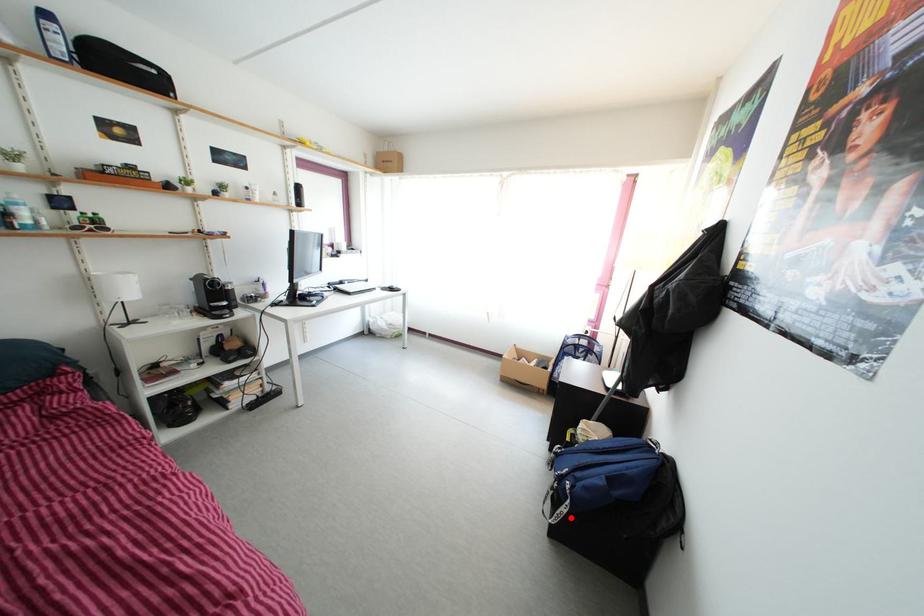
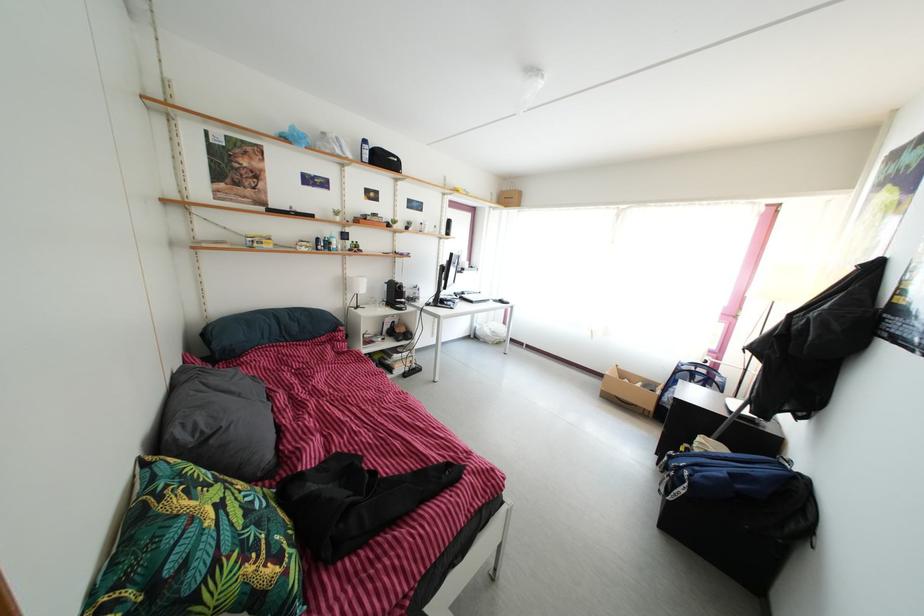
In the second image, find the point that corresponds to the highlighted location in the first image.

(687, 499)